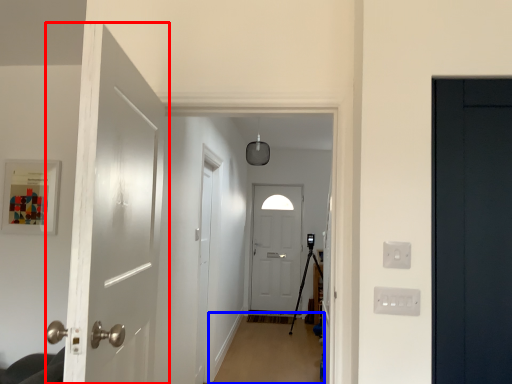
Question: Which object appears farthest to the camera in this image, door (highlighted by a red box) or plain (highlighted by a blue box)?

Choices:
 (A) door
 (B) plain

Answer: (B)